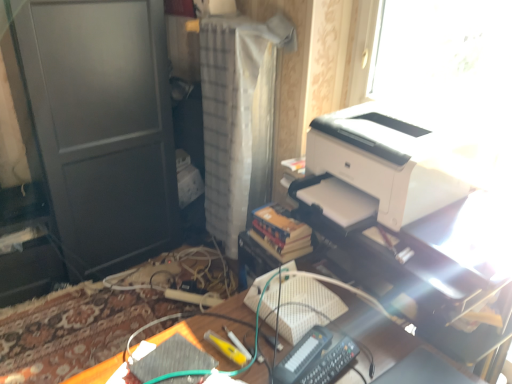
Question: Considering the relative positions of white matte printer at upper right and white textured curtain at center in the image provided, is white matte printer at upper right to the left or to the right of white textured curtain at center?

Choices:
 (A) left
 (B) right

Answer: (B)

Question: From a real-world perspective, relative to white textured curtain at center, is white matte printer at upper right vertically above or below?

Choices:
 (A) above
 (B) below

Answer: (A)

Question: Estimate the real-world distances between objects in this image. Which object is closer to the white textured curtain at center?

Choices:
 (A) white glossy printer at upper right
 (B) black plastic remote control at center
 (C) white matte printer at upper right
 (D) wooden desk at center

Answer: (C)

Question: Considering the real-world distances, which object is closest to the white glossy printer at upper right?

Choices:
 (A) black plastic remote control at center
 (B) white textured curtain at center
 (C) wooden desk at center
 (D) white matte printer at upper right

Answer: (D)